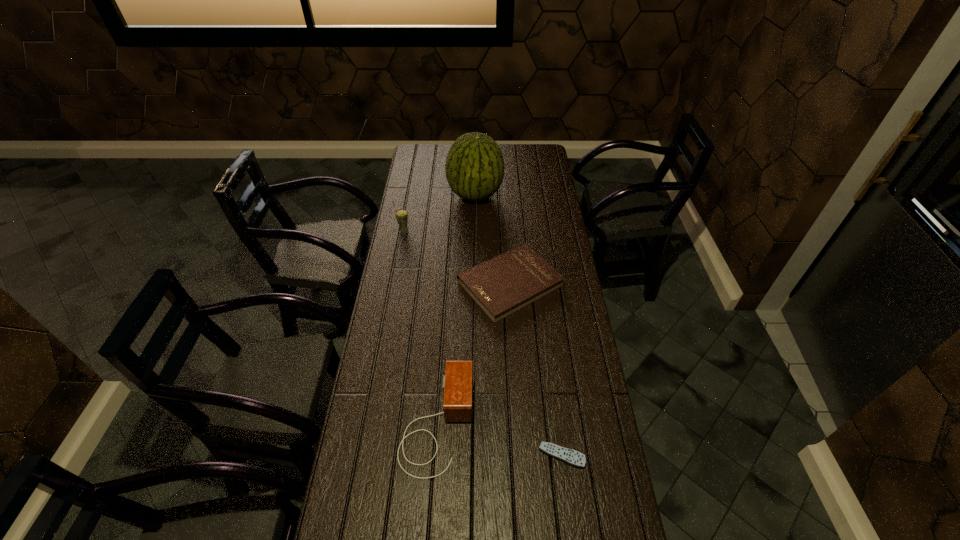
What are the coordinates of `the farthest object` in the screenshot? It's located at (474, 167).

Image resolution: width=960 pixels, height=540 pixels. In order to click on watermelon in this screenshot , I will do point(474,167).

The image size is (960, 540). I want to click on the second farthest object, so point(401,215).

Find the location of a particular element. the leftmost object is located at coordinates (401, 215).

Find the location of a particular element. The image size is (960, 540). the third shortest object is located at coordinates (458, 380).

Image resolution: width=960 pixels, height=540 pixels. Identify the location of the fourth tallest object. (506, 283).

In order to click on hardback book in this screenshot , I will do `click(506, 283)`.

This screenshot has width=960, height=540. In order to click on remote control in this screenshot , I will do `click(572, 457)`.

At what (x,y) coordinates should I click in order to perform the action: click on free space located on the front of the tallest object. Please return your answer as a coordinate pair (x, y). Looking at the image, I should click on (474, 234).

The width and height of the screenshot is (960, 540). In order to click on vacant space located on the front of the second tallest object in this screenshot , I will do `click(399, 256)`.